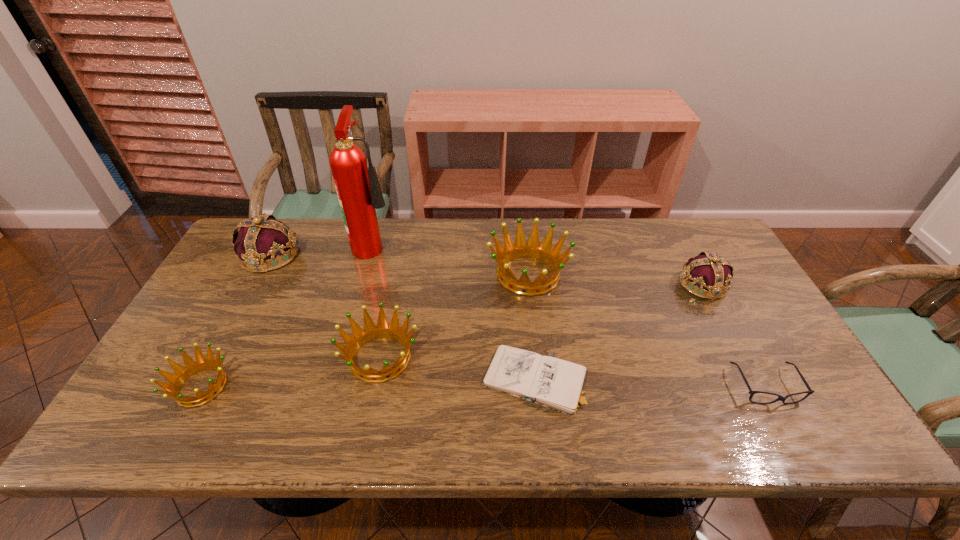
Locate an element on the screen. The width and height of the screenshot is (960, 540). golden crown that is the closest to the third crown from right to left is located at coordinates (520, 248).

Locate an element on the screen. The image size is (960, 540). free spot that satisfies the following two spatial constraints: 1. at the nozzle of the fire extinguisher; 2. on the back side of the notebook is located at coordinates (337, 380).

This screenshot has width=960, height=540. What are the coordinates of `vacant space that satisfies the following two spatial constraints: 1. on the back side of the fourth crown from left to right; 2. on the left side of the notebook` in the screenshot? It's located at (523, 274).